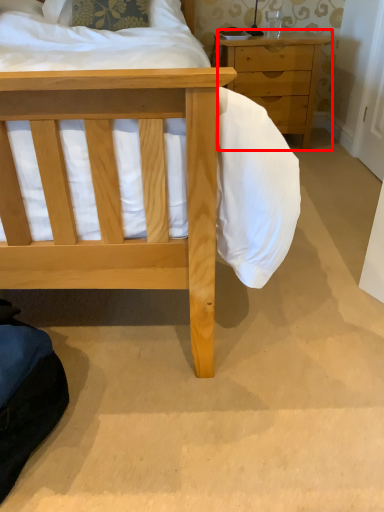
Question: In this image, where is chest of drawers (annotated by the red box) located relative to pillow?

Choices:
 (A) right
 (B) left

Answer: (A)